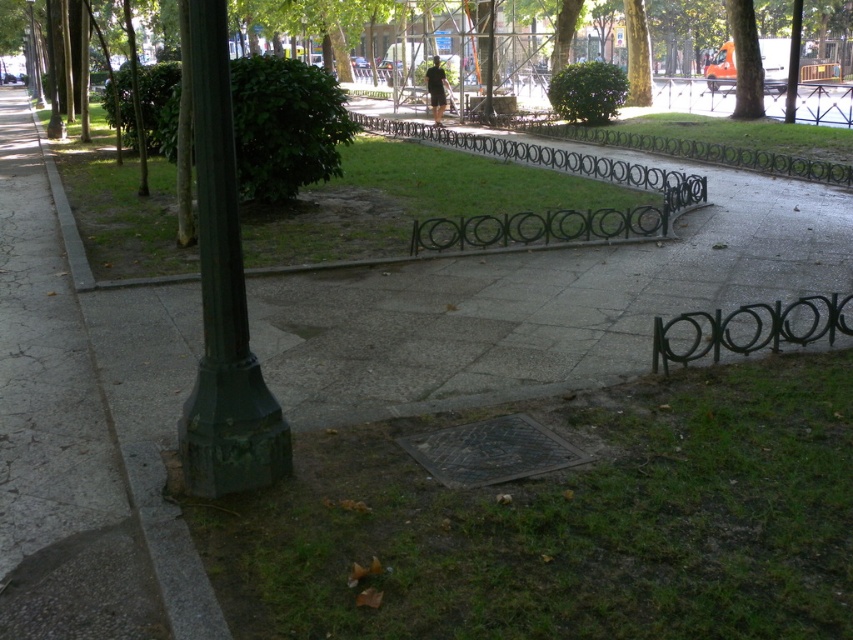
You are standing at the paved pathway near the dark green lamppost on the left. You want to reach the grassy area where the neatly maintained grass is. Which direction should you walk to get to the green grass at lower center?

The green grass at lower center is located at point [567,522], so you should walk towards the bottom center direction from the lamppost to reach it.

You are a gardener planning to water the green grass at center and the green matte pole at left. Which object is located above the other?

The green grass at center is positioned over the green matte pole at left, so the green grass at center is above the green matte pole at left.